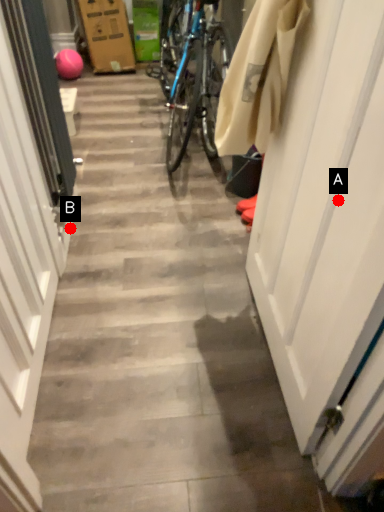
Question: Two points are circled on the image, labeled by A and B beside each circle. Which point appears farthest from the camera in this image?

Choices:
 (A) A is further
 (B) B is further

Answer: (B)